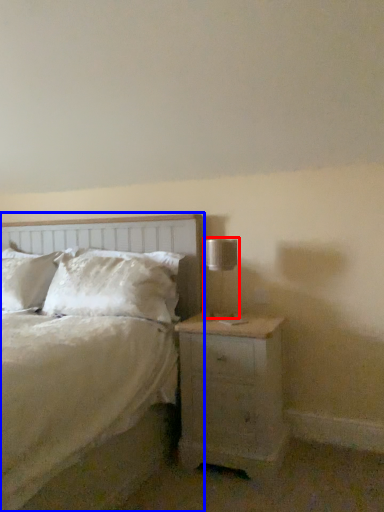
Question: Which point is further to the camera, table lamp (highlighted by a red box) or bed (highlighted by a blue box)?

Choices:
 (A) table lamp
 (B) bed

Answer: (A)